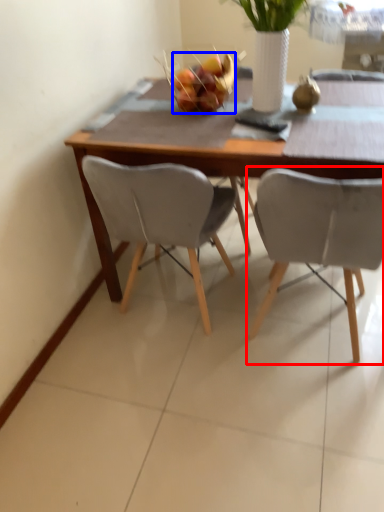
Question: Which of the following is the farthest to the observer, chair (highlighted by a red box) or fruit (highlighted by a blue box)?

Choices:
 (A) chair
 (B) fruit

Answer: (B)